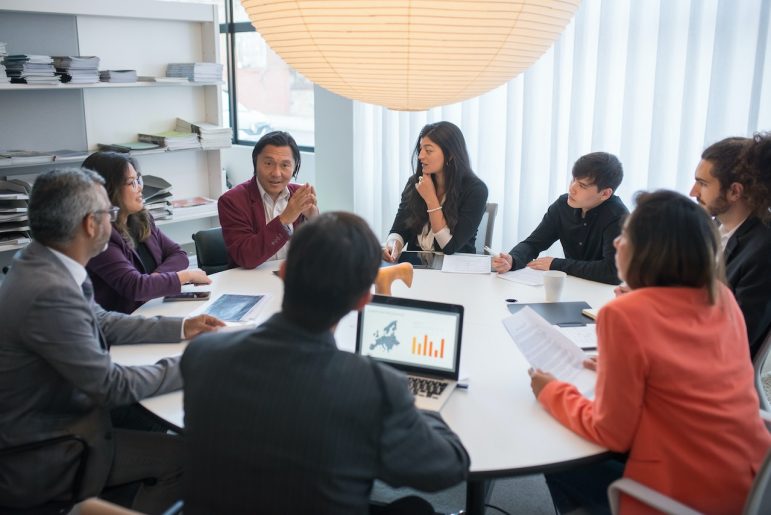
Find the location of a particular element. Image resolution: width=771 pixels, height=515 pixels. chair is located at coordinates (103, 506), (759, 504), (756, 365), (480, 227), (210, 239).